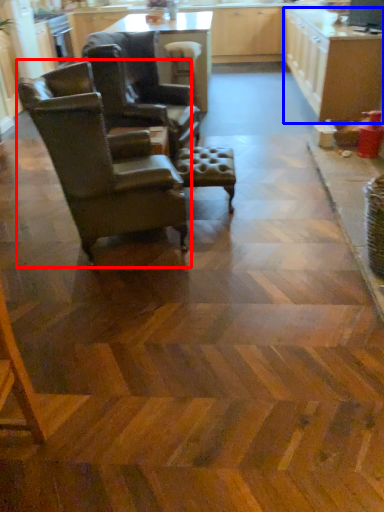
Question: Which of the following is the farthest to the observer, chair (highlighted by a red box) or cabinetry (highlighted by a blue box)?

Choices:
 (A) chair
 (B) cabinetry

Answer: (B)